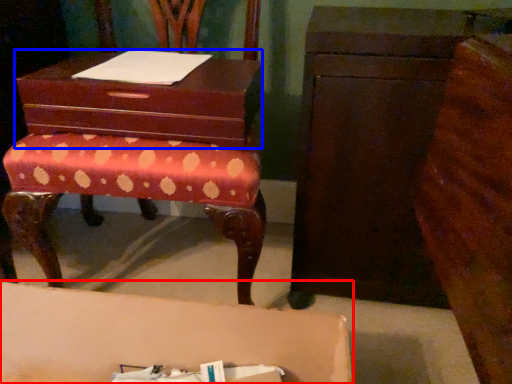
Question: Which object is further to the camera taking this photo, table (highlighted by a red box) or storage box (highlighted by a blue box)?

Choices:
 (A) table
 (B) storage box

Answer: (B)